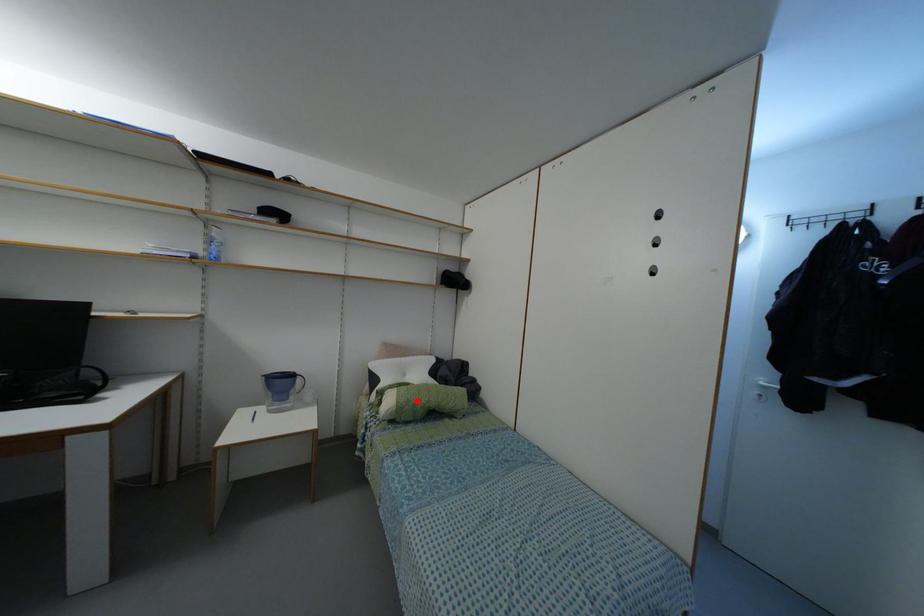
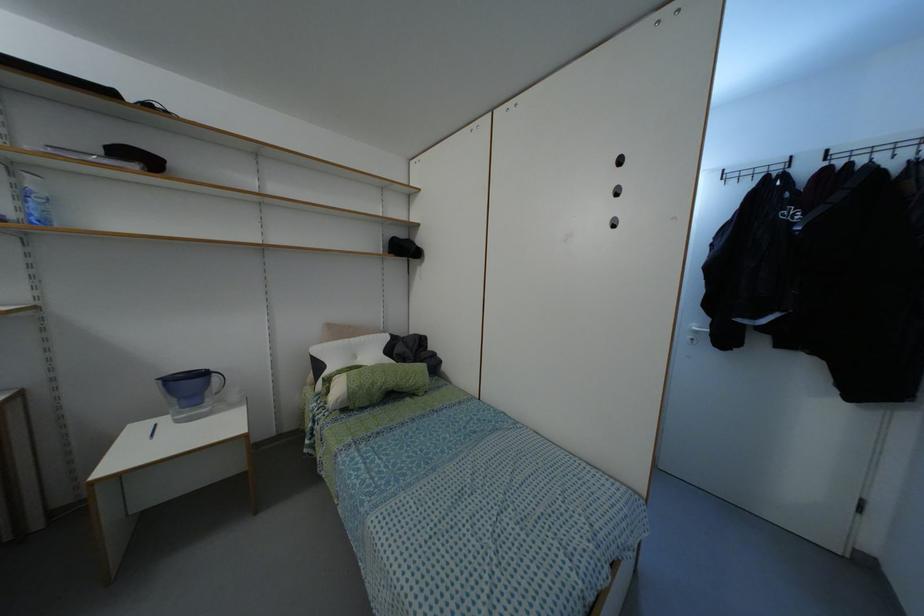
Question: A red point is marked in image1. In image2, is the corresponding 3D point closer to the camera or farther? Reply with the corresponding letter.

Choices:
 (A) The corresponding 3D point is closer.
 (B) The corresponding 3D point is farther.

Answer: (A)